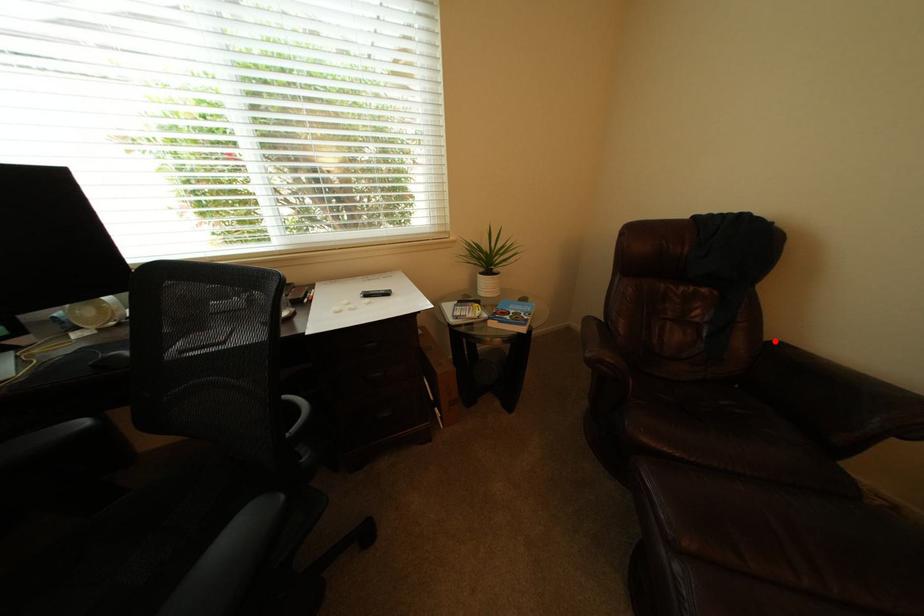
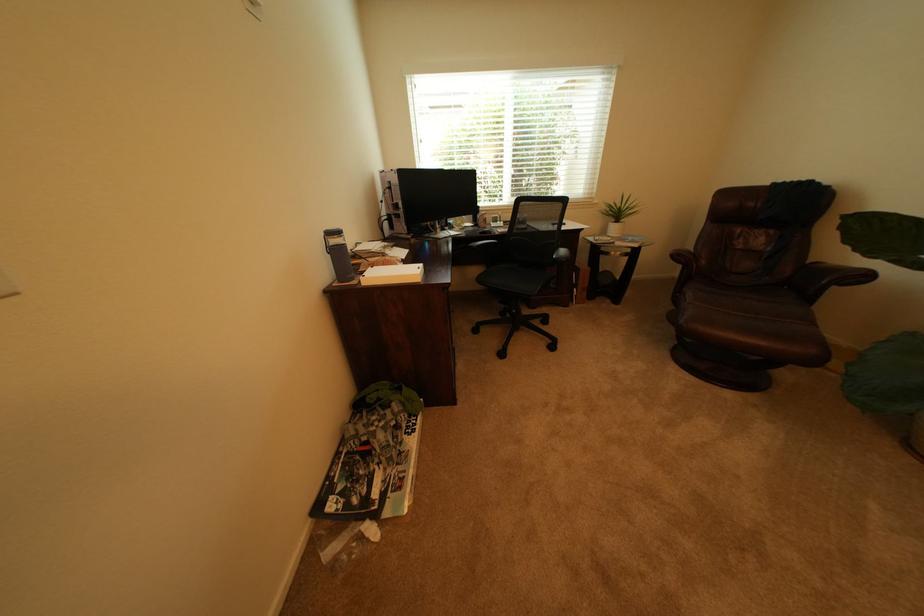
The point at the highlighted location is marked in the first image. Where is the corresponding point in the second image?

(821, 262)